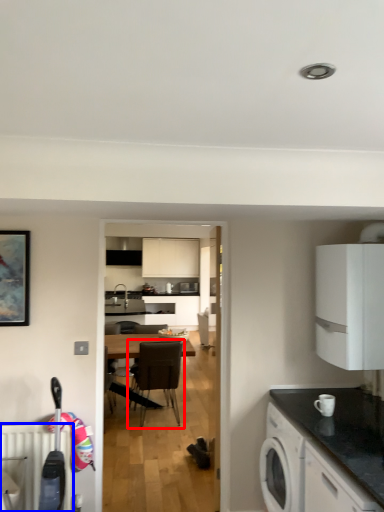
Question: Which object appears closest to the camera in this image, chair (highlighted by a red box) or radiator (highlighted by a blue box)?

Choices:
 (A) chair
 (B) radiator

Answer: (B)